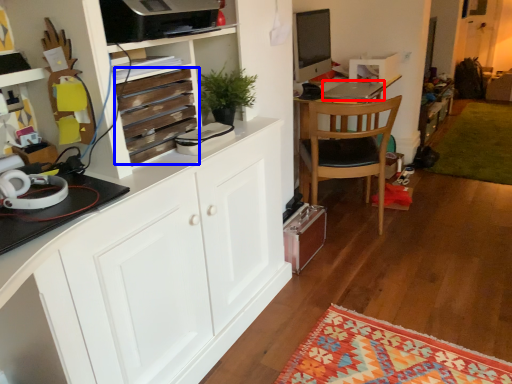
Question: Which of the following is the farthest to the observer, laptop (highlighted by a red box) or drawer (highlighted by a blue box)?

Choices:
 (A) laptop
 (B) drawer

Answer: (A)